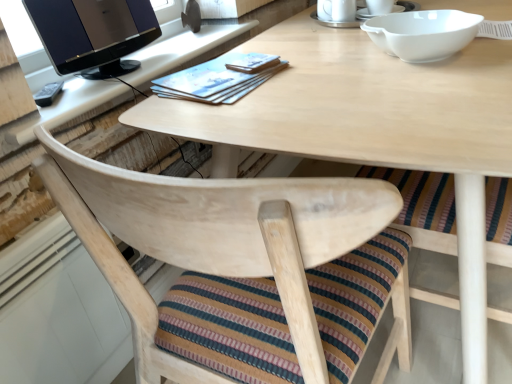
Where is `vacant location below satin black monitor at upper left (from a real-world perspective)`? vacant location below satin black monitor at upper left (from a real-world perspective) is located at coordinates (106, 71).